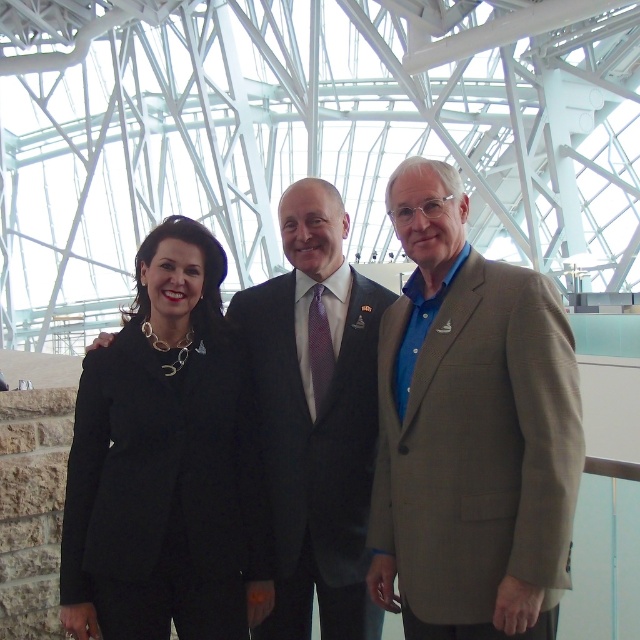
You are a photographer at a formal event and need to capture a clear photo of both the black fabric suit at center and the light brown textured blazer at center. Which one should you focus on first to ensure both are in focus?

You should focus on the black fabric suit at center first since it is closer to you than the light brown textured blazer at center, ensuring both will be in focus when properly adjusted.

You are a photographer at this event and need to ensure all attendees fit in a group photo. The camera frame can only accommodate clothing items up to the size of the light brown textured blazer at center. Will the black fabric suit at center fit within the frame?

The black fabric suit at center is bigger than the light brown textured blazer at center. Since the camera frame can only accommodate up to the size of the light brown textured blazer at center, the black fabric suit at center will not fit within the frame.

You are organizing a photo shoot and need to ensure that the light brown textured blazer at center and the black fabric suit at left are visible in the frame. Given that the camera has a fixed focal length, which clothing item should you prioritize positioning closer to the camera to ensure it fills the frame appropriately?

The light brown textured blazer at center is larger in size than the black fabric suit at left, so you should prioritize positioning the light brown textured blazer at center closer to the camera to ensure it fills the frame appropriately.